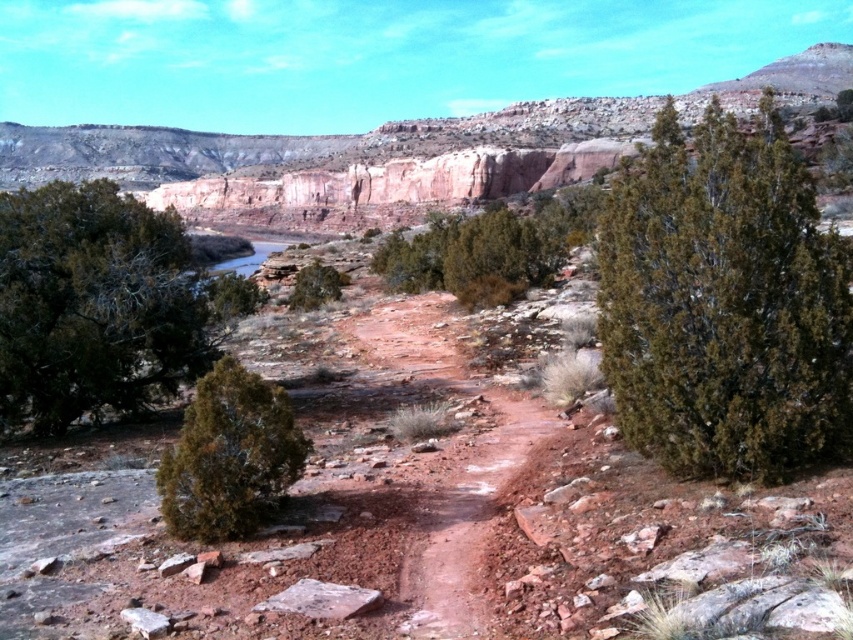
You are a hiker trying to navigate through the desert. You see the green matte tree at left and the green matte bush at center. Which one has a narrower width?

The green matte tree at left is thinner than the green matte bush at center, so the green matte tree at left has a narrower width.

You are a hiker navigating the desert landscape and see the green matte tree at left and the green matte bush at center. Which one is positioned lower in the image?

The green matte tree at left is located below the green matte bush at center, so it is positioned lower in the image.

You are a hiker trying to navigate through the desert. You see a dark green bush at upper right and a green matte tree at lower left. Which object is closer to you as you stand on the path?

The dark green bush at upper right is closer to you because it is in front of the green matte tree at lower left.